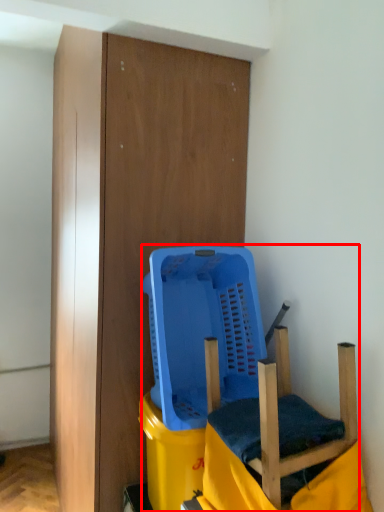
Question: From the image's perspective, considering the relative positions of furniture (annotated by the red box) and swivel chair in the image provided, where is furniture (annotated by the red box) located with respect to the staircase?

Choices:
 (A) above
 (B) below

Answer: (A)